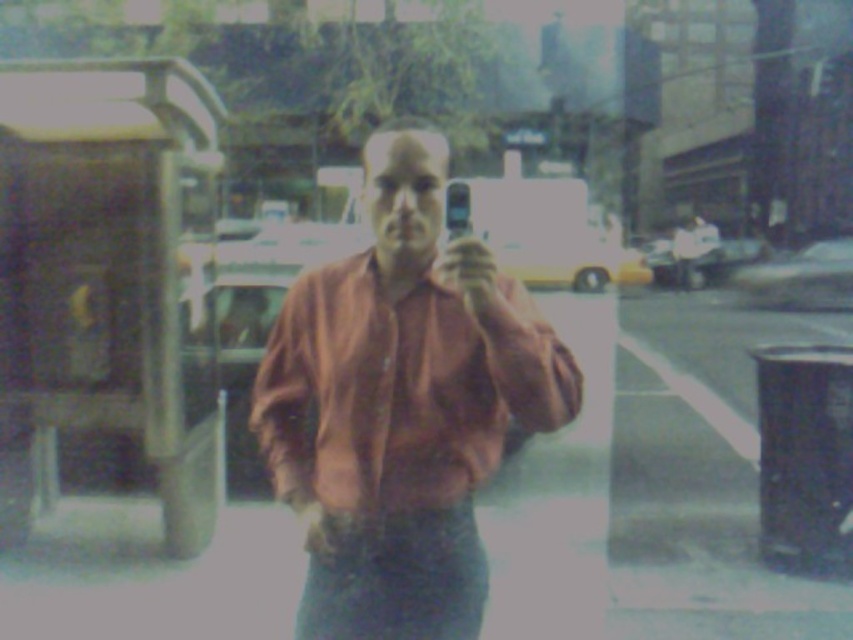
Based on the scene description, which object is taller between the matte pink shirt at center and the denim at lower center?

The matte pink shirt at center is much taller than the denim at lower center according to the description.

You are standing in the scene and want to move from the point at coordinates point (447, 371) to the point at coordinates point (473, 618). Which direction should you face to walk towards the second point?

Since point (447, 371) is closer to the viewer than point 0.967, 0556, you should face away from the viewer to walk towards the second point.

You are a photographer trying to capture a portrait of the person in the matte pink shirt at center and the denim at lower center. Which object should you focus on first if you want to ensure the subject closer to the camera is in focus?

The denim at lower center should be focused on first because it is closer to the camera than the matte pink shirt at center, which is positioned to the right of it.